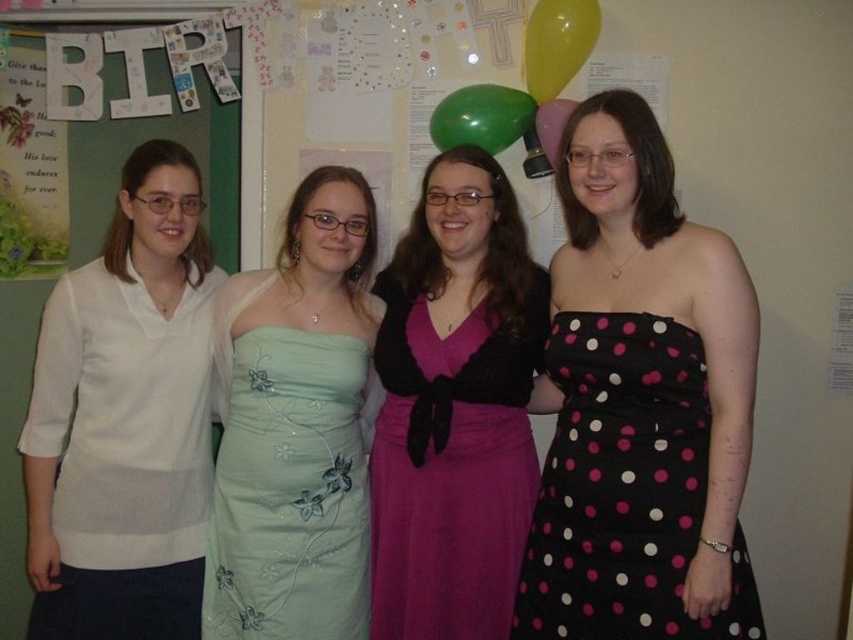
Question: Can you confirm if black polka dot dress at right is positioned to the right of rubber balloon at upper center?

Choices:
 (A) no
 (B) yes

Answer: (B)

Question: Which of the following is the farthest from the observer?

Choices:
 (A) yellow rubber balloon at upper right
 (B) black polka dot dress at right
 (C) white cotton shirt at left
 (D) rubber balloon at upper center

Answer: (D)

Question: Estimate the real-world distances between objects in this image. Which object is farther from the black polka dot dress at right?

Choices:
 (A) light green satin dress at center
 (B) green rubber balloon at upper center
 (C) rubber balloon at upper center
 (D) yellow rubber balloon at upper right

Answer: (D)

Question: Is yellow rubber balloon at upper right positioned at the back of green rubber balloon at upper center?

Choices:
 (A) yes
 (B) no

Answer: (B)

Question: Estimate the real-world distances between objects in this image. Which object is closer to the green rubber balloon at upper center?

Choices:
 (A) light green satin dress at center
 (B) white cotton shirt at left
 (C) rubber balloon at upper center

Answer: (C)

Question: Is light green satin dress at center closer to camera compared to yellow rubber balloon at upper right?

Choices:
 (A) yes
 (B) no

Answer: (A)